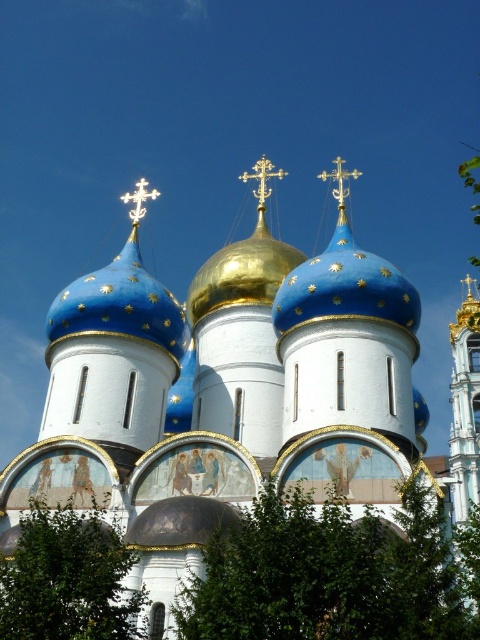
Question: Does white metallic cross at upper left have a greater width compared to gold metallic cross at upper center?

Choices:
 (A) no
 (B) yes

Answer: (B)

Question: Which is farther from the gold metallic cross at center?

Choices:
 (A) gold metallic cross at upper center
 (B) green leafy tree at center

Answer: (B)

Question: Among these points, which one is nearest to the camera?

Choices:
 (A) [429, 493]
 (B) [300, 301]

Answer: (A)

Question: Among these points, which one is farthest from the camera?

Choices:
 (A) (269, 195)
 (B) (373, 257)
 (C) (109, 596)
 (D) (355, 170)

Answer: (A)

Question: Where is blue/golden domed church at center located in relation to gold metallic cross at center in the image?

Choices:
 (A) left
 (B) right

Answer: (B)

Question: Where is green leafy tree at center located in relation to gold metallic cross at upper center in the image?

Choices:
 (A) below
 (B) above

Answer: (A)